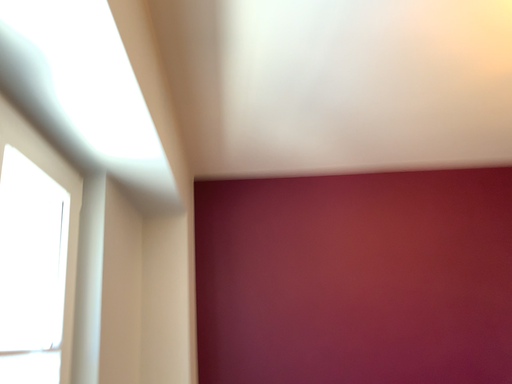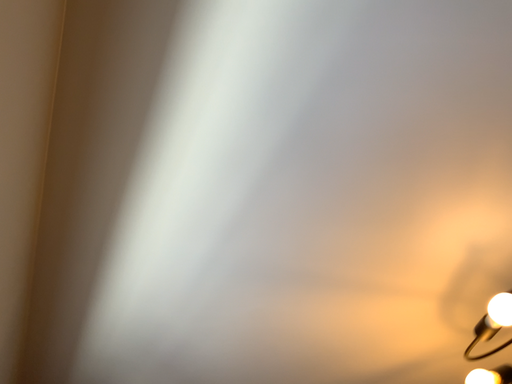
Question: Which way did the camera rotate in the video?

Choices:
 (A) rotated right
 (B) rotated left

Answer: (A)